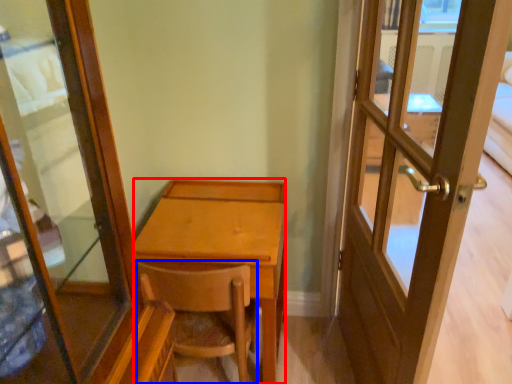
Question: Which point is further to the camera, desk (highlighted by a red box) or chair (highlighted by a blue box)?

Choices:
 (A) desk
 (B) chair

Answer: (A)